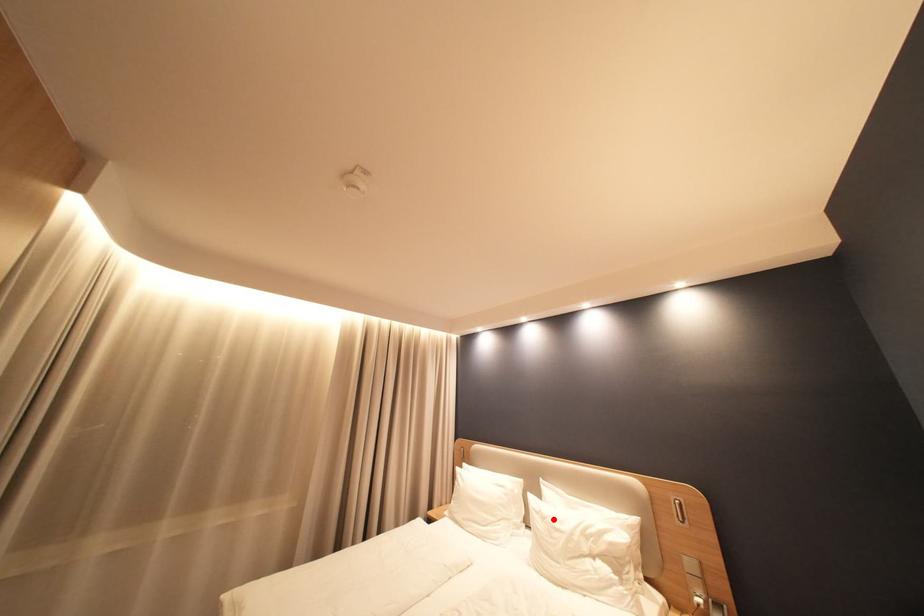
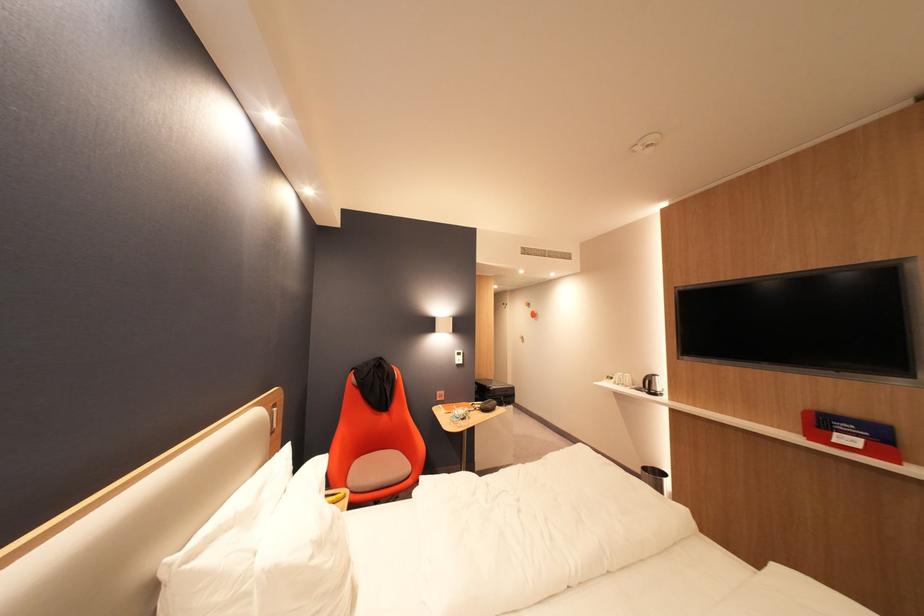
Locate, in the second image, the point that corresponds to the highlighted location in the first image.

(330, 545)